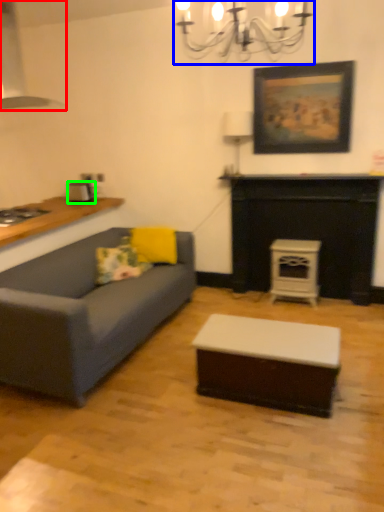
Question: Which object is positioned farthest from exhaust hood (highlighted by a red box)? Select from light fixture (highlighted by a blue box) and appliance (highlighted by a green box).

Choices:
 (A) light fixture
 (B) appliance

Answer: (A)